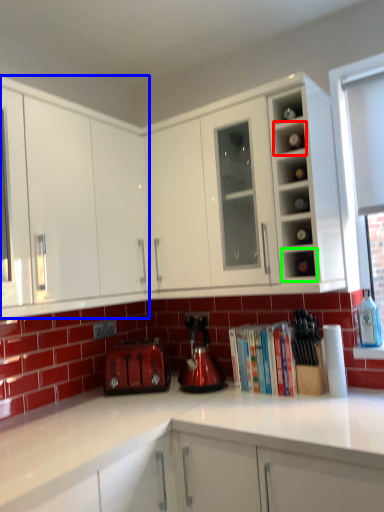
Question: Which object is positioned closest to shelf (highlighted by a red box)? Select from cabinetry (highlighted by a blue box) and shelf (highlighted by a green box).

Choices:
 (A) cabinetry
 (B) shelf

Answer: (B)